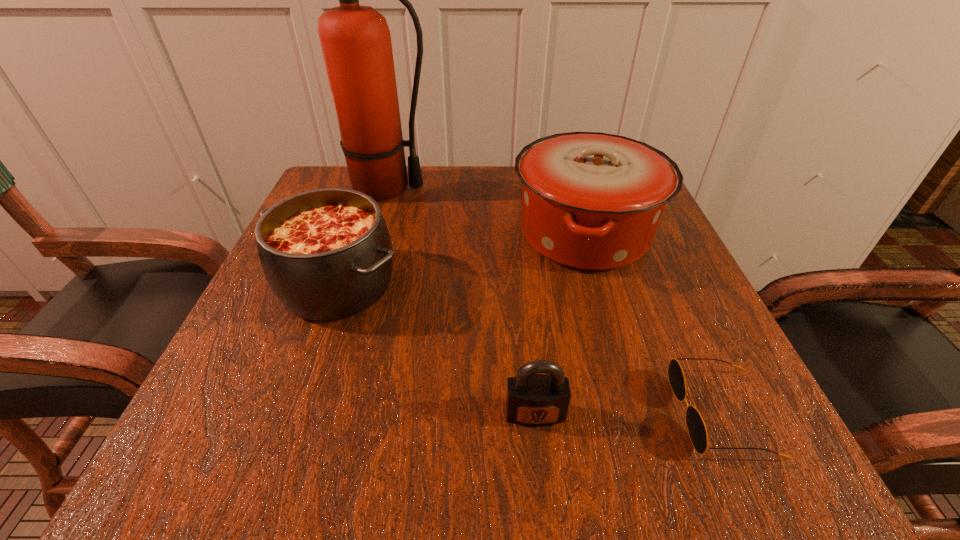
I want to click on vacant area in the image that satisfies the following two spatial constraints: 1. on the nozzle of the fire extinguisher; 2. on the front side of the left casserole, so click(x=357, y=285).

Where is `free region that satisfies the following two spatial constraints: 1. on the front-facing side of the sunglasses; 2. on the front of the fourth tallest object near the keyhole`? This screenshot has width=960, height=540. free region that satisfies the following two spatial constraints: 1. on the front-facing side of the sunglasses; 2. on the front of the fourth tallest object near the keyhole is located at coordinates (721, 414).

You are a GUI agent. You are given a task and a screenshot of the screen. Output one action in this format:
    pyautogui.click(x=<x>, y=<y>)
    Task: Click on the vacant region that satisfies the following two spatial constraints: 1. on the front-facing side of the shortest object; 2. on the front of the fourth tallest object near the keyhole
    This screenshot has height=540, width=960.
    Given the screenshot: What is the action you would take?
    pyautogui.click(x=721, y=414)

Where is `free space that satisfies the following two spatial constraints: 1. on the front-facing side of the shortest object; 2. on the front of the fourth tallest object near the keyhole`? This screenshot has height=540, width=960. free space that satisfies the following two spatial constraints: 1. on the front-facing side of the shortest object; 2. on the front of the fourth tallest object near the keyhole is located at coordinates (721, 414).